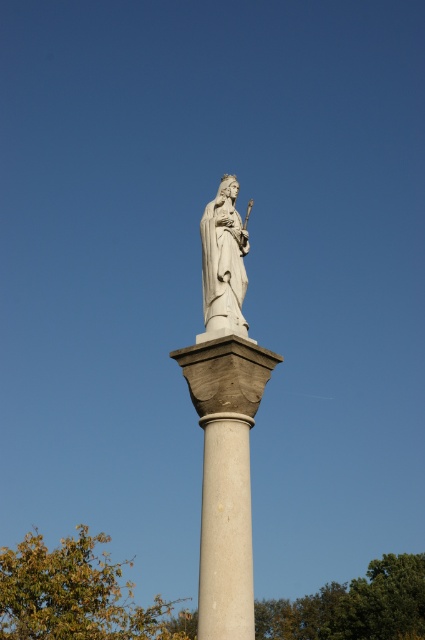
Based on the photo, does white stone column at center appear on the right side of white marble statue at center?

Indeed, white stone column at center is positioned on the right side of white marble statue at center.

Between white stone column at center and white marble statue at center, which one appears on the right side from the viewer's perspective?

white stone column at center is more to the right.

Is point (223, 582) positioned in front of point (235, 237)?

That is True.

Locate an element on the screen. The image size is (425, 640). white stone column at center is located at coordinates (226, 476).

Which of these two, white marble column at center or white marble statue at center, stands taller?

white marble statue at center

This screenshot has height=640, width=425. What do you see at coordinates (226, 531) in the screenshot? I see `white marble column at center` at bounding box center [226, 531].

Is point (243, 529) farther from viewer compared to point (210, 246)?

No, (243, 529) is in front of (210, 246).

Where is `white marble column at center`? The width and height of the screenshot is (425, 640). white marble column at center is located at coordinates (226, 531).

Is point (221, 464) farther from camera compared to point (206, 627)?

Yes, it is.

Does white stone column at center have a greater height compared to white marble column at center?

Indeed, white stone column at center has a greater height compared to white marble column at center.

Is point (232, 486) closer to camera compared to point (243, 508)?

Yes, it is.

I want to click on white stone column at center, so click(226, 476).